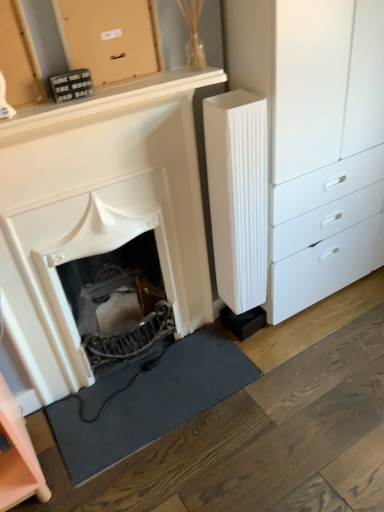
Question: Is wooden board at upper center, which is the 1th cabinetry in right-to-left order, positioned far away from white matte fireplace at center?

Choices:
 (A) no
 (B) yes

Answer: (A)

Question: Is wooden board at upper center, placed as the 2th cabinetry when sorted from bottom to top, at the right side of white matte fireplace at center?

Choices:
 (A) no
 (B) yes

Answer: (B)

Question: From the image's perspective, is wooden board at upper center, which is the 1th cabinetry in right-to-left order, located beneath white matte fireplace at center?

Choices:
 (A) yes
 (B) no

Answer: (B)

Question: Does wooden board at upper center, placed as the 2th cabinetry when sorted from bottom to top, have a lesser width compared to white matte fireplace at center?

Choices:
 (A) yes
 (B) no

Answer: (A)

Question: Is wooden board at upper center, which is the 1th cabinetry in right-to-left order, bigger than white matte fireplace at center?

Choices:
 (A) no
 (B) yes

Answer: (A)

Question: Is wooden board at upper center, placed as the 2th cabinetry when sorted from bottom to top, located outside white matte fireplace at center?

Choices:
 (A) no
 (B) yes

Answer: (B)

Question: From the image's perspective, is pink matte cabinet at lower left, the first cabinetry in the left-to-right sequence, on top of black rubber doormat at lower left?

Choices:
 (A) no
 (B) yes

Answer: (B)

Question: Can you confirm if pink matte cabinet at lower left, which is the 1th cabinetry from bottom to top, is thinner than black rubber doormat at lower left?

Choices:
 (A) yes
 (B) no

Answer: (A)

Question: Is pink matte cabinet at lower left, which is the 1th cabinetry from bottom to top, not within black rubber doormat at lower left?

Choices:
 (A) yes
 (B) no

Answer: (A)

Question: Is pink matte cabinet at lower left, which is the 1th cabinetry from bottom to top, to the right of black rubber doormat at lower left from the viewer's perspective?

Choices:
 (A) no
 (B) yes

Answer: (A)

Question: Is pink matte cabinet at lower left, the first cabinetry in the left-to-right sequence, touching black rubber doormat at lower left?

Choices:
 (A) yes
 (B) no

Answer: (B)

Question: Are pink matte cabinet at lower left, the second cabinetry in the right-to-left sequence, and black rubber doormat at lower left far apart?

Choices:
 (A) no
 (B) yes

Answer: (A)

Question: Can you confirm if white matte fireplace at center is thinner than black rubber doormat at lower left?

Choices:
 (A) no
 (B) yes

Answer: (B)